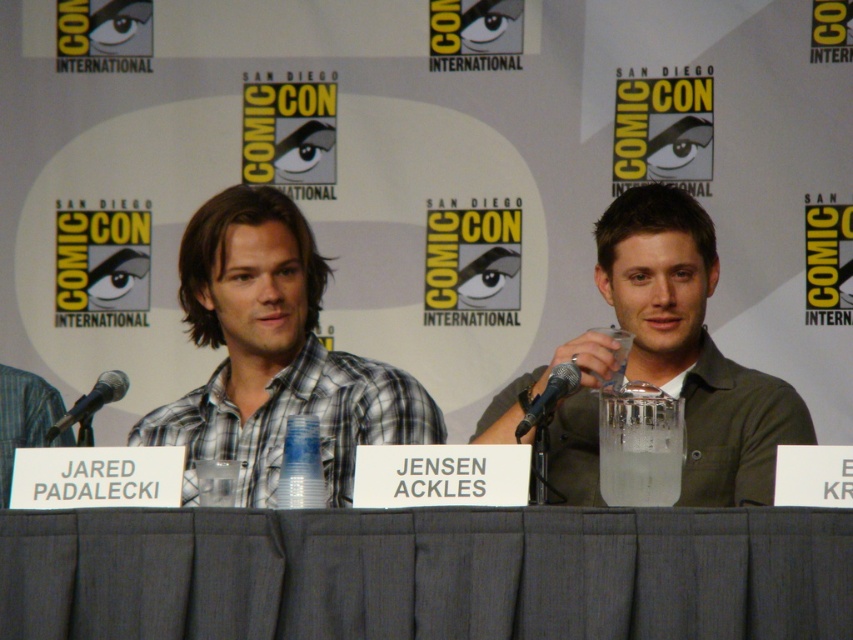
Does point (639, 401) come farther from viewer compared to point (566, 369)?

No.

I want to click on clear glass cup at center, so pyautogui.click(x=639, y=445).

Who is shorter, plaid cotton shirt at center or black metallic microphone at left?

With less height is black metallic microphone at left.

Which is in front, point (206, 422) or point (73, 410)?

Point (73, 410) is more forward.

Is point (202, 236) in front of point (103, 401)?

No, (202, 236) is behind (103, 401).

Locate an element on the screen. This screenshot has height=640, width=853. plaid cotton shirt at center is located at coordinates (273, 355).

Measure the distance between gray fabric table at center and camera.

A distance of 2.54 meters exists between gray fabric table at center and camera.

At what (x,y) coordinates should I click in order to perform the action: click on gray fabric table at center. Please return your answer as a coordinate pair (x, y). This screenshot has width=853, height=640. Looking at the image, I should click on (426, 573).